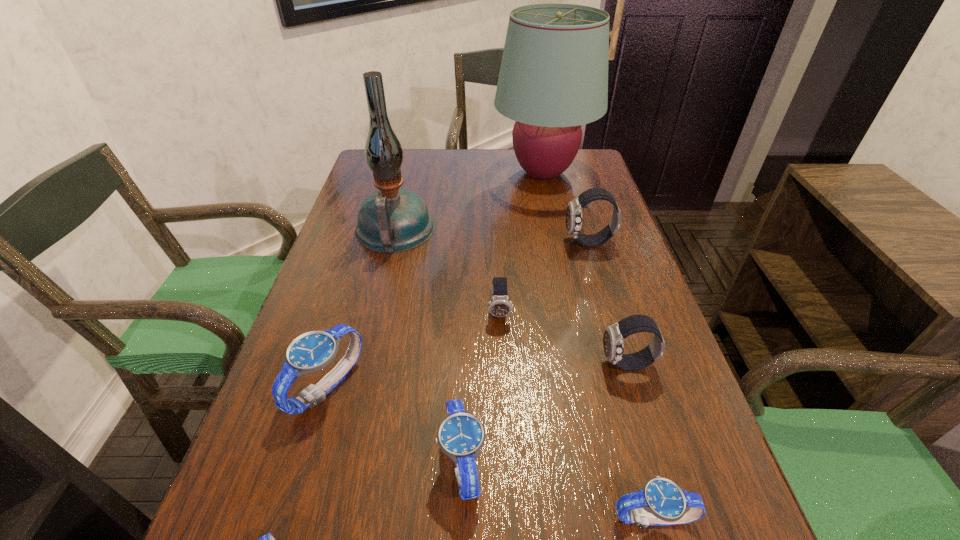
Where is `dark watch that can be found as the second closest to the nearest dark watch`? This screenshot has width=960, height=540. dark watch that can be found as the second closest to the nearest dark watch is located at coordinates (574, 209).

Select which dark watch is the second closest to the second nearest dark watch. Please provide its 2D coordinates. Your answer should be formatted as a tuple, i.e. [(x, y)], where the tuple contains the x and y coordinates of a point satisfying the conditions above.

[(574, 209)]

At what (x,y) coordinates should I click in order to perform the action: click on the second closest blue watch to the leftmost dark watch. Please return your answer as a coordinate pair (x, y). The width and height of the screenshot is (960, 540). Looking at the image, I should click on (313, 351).

At what (x,y) coordinates should I click in order to perform the action: click on the second closest blue watch to the oil lamp. Please return your answer as a coordinate pair (x, y). Image resolution: width=960 pixels, height=540 pixels. Looking at the image, I should click on [x=461, y=435].